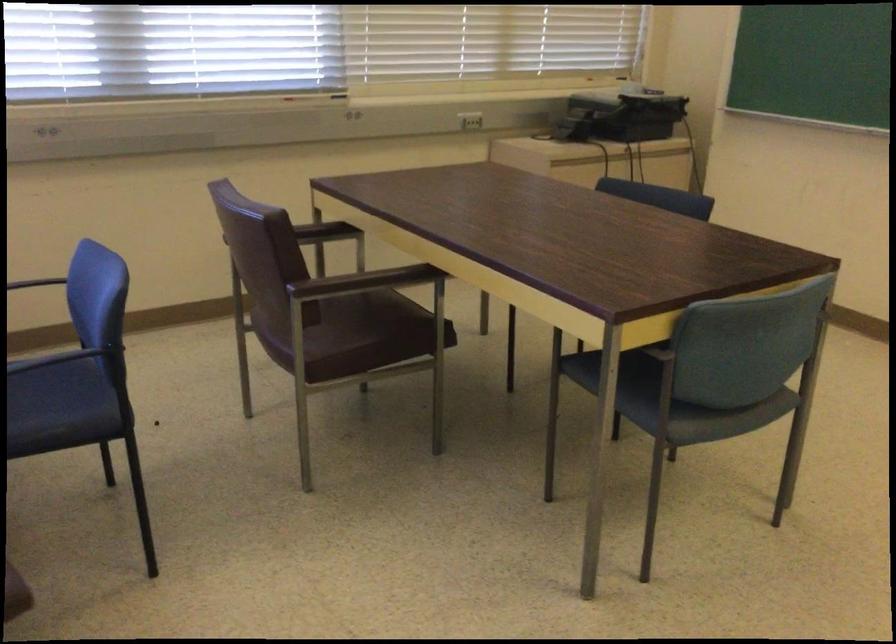
What do you see at coordinates (362, 281) in the screenshot? The image size is (896, 644). I see `the dark blue sitting surface` at bounding box center [362, 281].